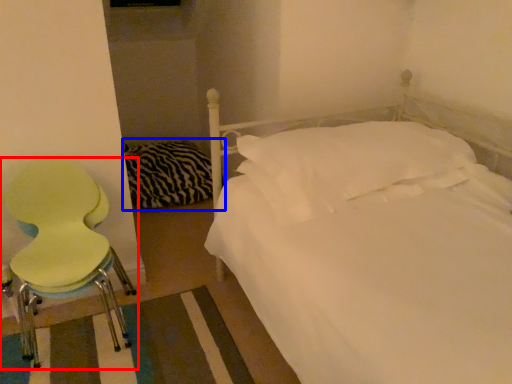
Question: Which of the following is the farthest to the observer, chair (highlighted by a red box) or bedding (highlighted by a blue box)?

Choices:
 (A) chair
 (B) bedding

Answer: (B)